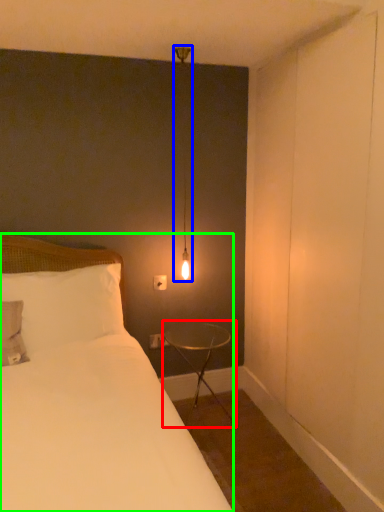
Question: Considering the real-world distances, which object is farthest from table (highlighted by a red box)? light fixture (highlighted by a blue box) or bed (highlighted by a green box)?

Choices:
 (A) light fixture
 (B) bed

Answer: (A)